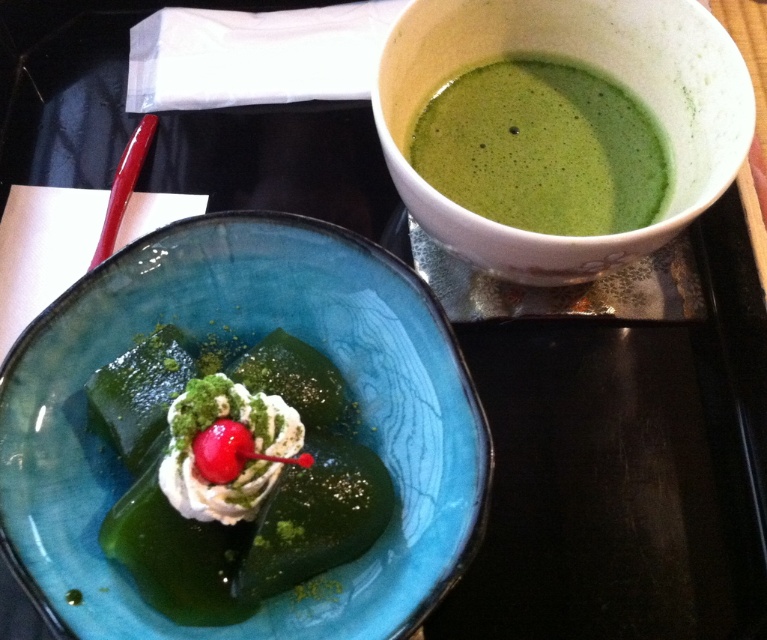
Does translucent glass bowl at center have a larger size compared to white ceramic bowl at upper right?

Indeed, translucent glass bowl at center has a larger size compared to white ceramic bowl at upper right.

Locate an element on the screen. The image size is (767, 640). translucent glass bowl at center is located at coordinates (245, 339).

Who is lower down, white ceramic bowl at upper right or green frothy soup at upper right?

green frothy soup at upper right

Does white ceramic bowl at upper right have a larger size compared to green frothy soup at upper right?

Indeed, white ceramic bowl at upper right has a larger size compared to green frothy soup at upper right.

In the scene shown: Measure the distance between white ceramic bowl at upper right and camera.

32.15 inches

Identify the location of white ceramic bowl at upper right. This screenshot has height=640, width=767. (588, 67).

Is green gelatinous dessert at center to the left of green frothy soup at upper right from the viewer's perspective?

Indeed, green gelatinous dessert at center is positioned on the left side of green frothy soup at upper right.

Is green gelatinous dessert at center behind green frothy soup at upper right?

That is False.

Who is more forward, (328, 486) or (647, 129)?

Point (328, 486) is in front.

This screenshot has width=767, height=640. I want to click on green gelatinous dessert at center, so click(234, 477).